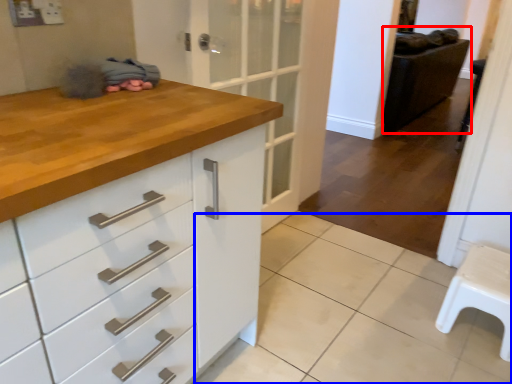
Question: Which of the following is the closest to the observer, chair (highlighted by a red box) or tile (highlighted by a blue box)?

Choices:
 (A) chair
 (B) tile

Answer: (B)